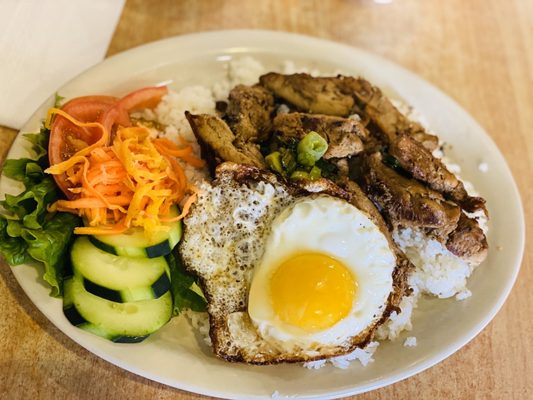
Image resolution: width=533 pixels, height=400 pixels. I want to click on napkin, so click(x=24, y=76).